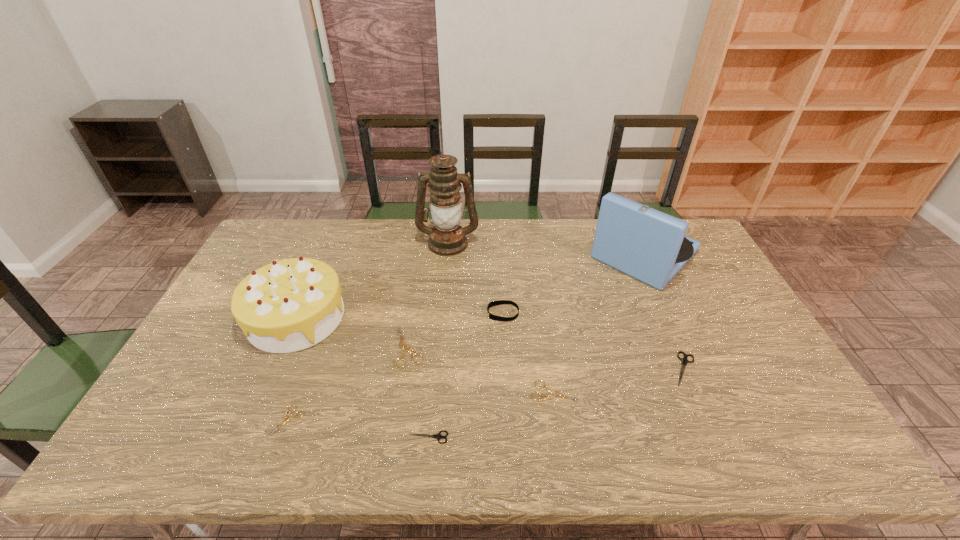
In order to click on the second nearest beige shears in this screenshot , I will do `click(553, 393)`.

Where is `the third object from right to left`? the third object from right to left is located at coordinates point(553,393).

The width and height of the screenshot is (960, 540). What are the coordinates of `the left black shears` in the screenshot? It's located at (438, 436).

At what (x,y) coordinates should I click in order to perform the action: click on the smaller black shears. Please return your answer as a coordinate pair (x, y). The height and width of the screenshot is (540, 960). Looking at the image, I should click on (438, 436).

This screenshot has height=540, width=960. What are the coordinates of `the smallest beige shears` in the screenshot? It's located at (286, 415).

Image resolution: width=960 pixels, height=540 pixels. I want to click on the leftmost beige shears, so click(x=286, y=415).

Image resolution: width=960 pixels, height=540 pixels. I want to click on vacant space located 0.220m on the front of the tallest object, so click(x=443, y=300).

Where is `vacant point located 0.240m on the front of the eighth shortest object`? The height and width of the screenshot is (540, 960). vacant point located 0.240m on the front of the eighth shortest object is located at coordinates (687, 351).

The width and height of the screenshot is (960, 540). What are the coordinates of `free point located 0.250m on the front of the third tallest object` in the screenshot? It's located at (243, 441).

Identify the location of free location located on the display of the sixth shortest object. Image resolution: width=960 pixels, height=540 pixels. (460, 313).